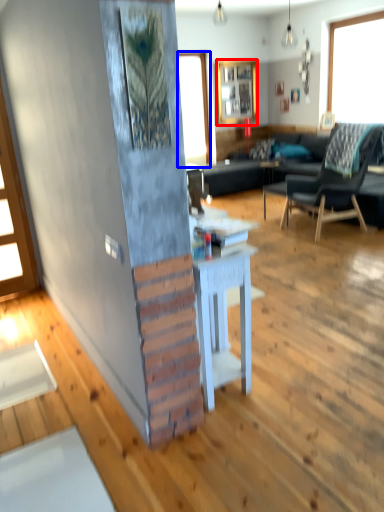
Question: Which object is closer to the camera taking this photo, cabinetry (highlighted by a red box) or window (highlighted by a blue box)?

Choices:
 (A) cabinetry
 (B) window

Answer: (B)